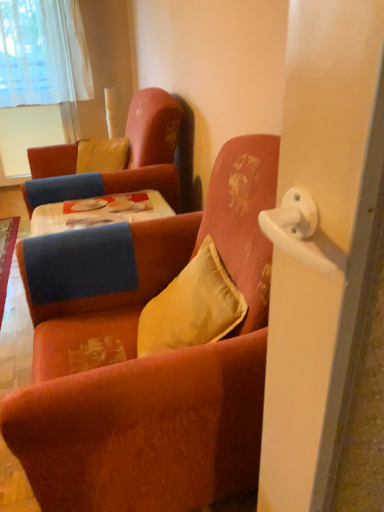
Question: Is yellow velvet pillow at upper left, which is counted as the 2th pillow, starting from the right, wider or thinner than velvet orange armchair at upper left, positioned as the first chair in back-to-front order?

Choices:
 (A) wide
 (B) thin

Answer: (B)

Question: From the image's perspective, is yellow velvet pillow at upper left, which is the 1th pillow from left to right, positioned above or below velvet orange armchair at upper left, the 2th chair in the front-to-back sequence?

Choices:
 (A) above
 (B) below

Answer: (A)

Question: Based on their relative distances, which object is farther from the velvet orange armchair at center, which is the first chair from front to back?

Choices:
 (A) white sheer curtain at upper left
 (B) velvet orange armchair at upper left, the 2th chair in the front-to-back sequence
 (C) yellow velvet pillow at upper left, the second pillow ordered from the bottom
 (D) satin yellow pillow at center, acting as the 2th pillow starting from the left

Answer: (A)

Question: Estimate the real-world distances between objects in this image. Which object is farther from the white sheer curtain at upper left?

Choices:
 (A) velvet orange armchair at center, which is the first chair from front to back
 (B) velvet orange armchair at upper left, positioned as the first chair in back-to-front order
 (C) satin yellow pillow at center, which ranks as the first pillow in right-to-left order
 (D) yellow velvet pillow at upper left, the second pillow ordered from the bottom

Answer: (C)